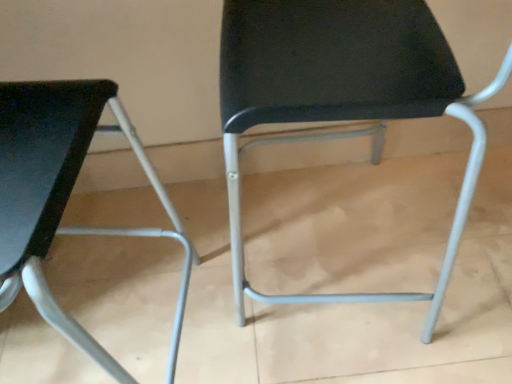
Find the location of a particular element. vacant space underneath black fabric chair at center, the 1th chair from the right (from a real-world perspective) is located at coordinates (327, 253).